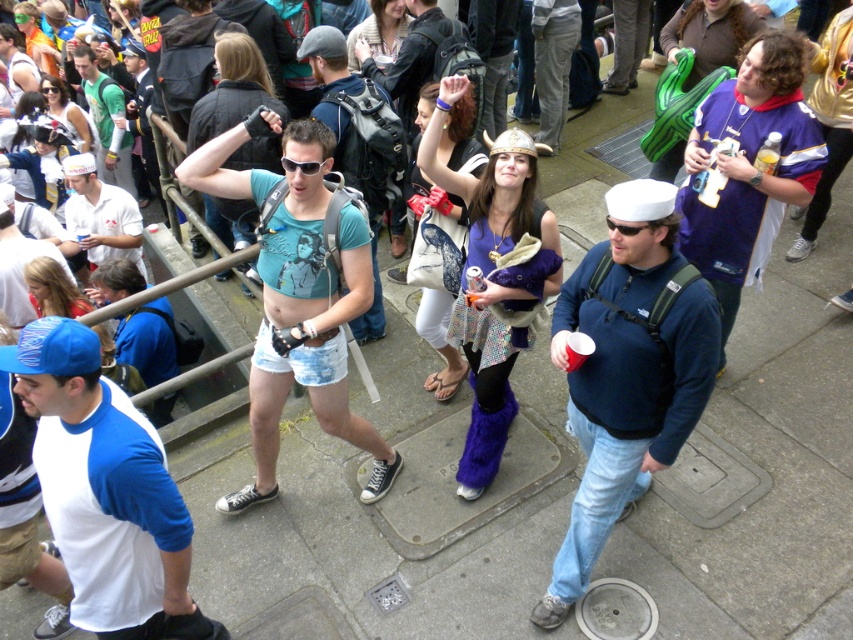
Between point (177, 371) and point (112, 237), which one is positioned behind?

The point (112, 237) is more distant.

Does point (122, 356) lie behind point (109, 208)?

No, it is in front of (109, 208).

Identify the location of blue fabric shirt at left. click(x=148, y=340).

Where is `blue fabric shirt at left`? The image size is (853, 640). blue fabric shirt at left is located at coordinates (148, 340).

Locate an element on the screen. This screenshot has width=853, height=640. matte blue t-shirt at center is located at coordinates (334, 81).

Which is behind, point (376, 305) or point (80, 109)?

Point (80, 109)

Where is `matte blue t-shirt at center`? This screenshot has height=640, width=853. matte blue t-shirt at center is located at coordinates (334, 81).

Locate an element on the screen. The width and height of the screenshot is (853, 640). matte blue t-shirt at center is located at coordinates [x=334, y=81].

Who is positioned more to the right, white matte cap at left or matte black sunglasses at upper left?

From the viewer's perspective, white matte cap at left appears more on the right side.

Is white matte cap at left taller than matte black sunglasses at upper left?

Yes.

Find the location of a particular element. white matte cap at left is located at coordinates (102, 214).